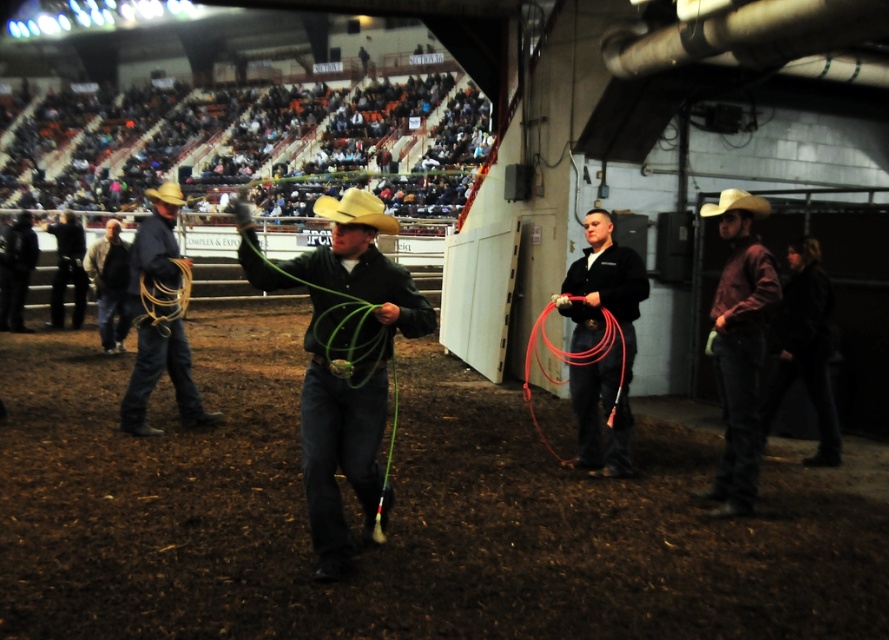
Is matte brown rope at left smaller than light brown felt cowboy hat at right?

Incorrect, matte brown rope at left is not smaller in size than light brown felt cowboy hat at right.

Who is positioned more to the right, matte brown rope at left or light brown felt cowboy hat at right?

Positioned to the right is light brown felt cowboy hat at right.

At what (x,y) coordinates should I click in order to perform the action: click on matte brown rope at left. Please return your answer as a coordinate pair (x, y). This screenshot has height=640, width=889. Looking at the image, I should click on (159, 323).

Find the location of a particular element. The height and width of the screenshot is (640, 889). matte brown rope at left is located at coordinates (159, 323).

Does yellow felt cowboy hat at center have a smaller size compared to rustic leather cowboy hat at center?

Indeed, yellow felt cowboy hat at center has a smaller size compared to rustic leather cowboy hat at center.

The height and width of the screenshot is (640, 889). Describe the element at coordinates (356, 211) in the screenshot. I see `yellow felt cowboy hat at center` at that location.

Between point (366, 193) and point (154, 196), which one is positioned behind?

The point (154, 196) is behind.

At what (x,y) coordinates should I click in order to perform the action: click on yellow felt cowboy hat at center. Please return your answer as a coordinate pair (x, y). This screenshot has width=889, height=640. Looking at the image, I should click on (356, 211).

Between point (62, 237) and point (398, 225), which one is positioned behind?

The point (62, 237) is behind.

Measure the distance between black leather cowboy hat at left and yellow felt cowboy hat at center.

The distance of black leather cowboy hat at left from yellow felt cowboy hat at center is 9.21 meters.

Who is more forward, (76, 221) or (366, 193)?

Positioned in front is point (366, 193).

You are a GUI agent. You are given a task and a screenshot of the screen. Output one action in this format:
    pyautogui.click(x=<x>, y=<y>)
    Task: Click on the black leather cowboy hat at left
    The image size is (889, 640).
    Given the screenshot: What is the action you would take?
    pyautogui.click(x=68, y=269)